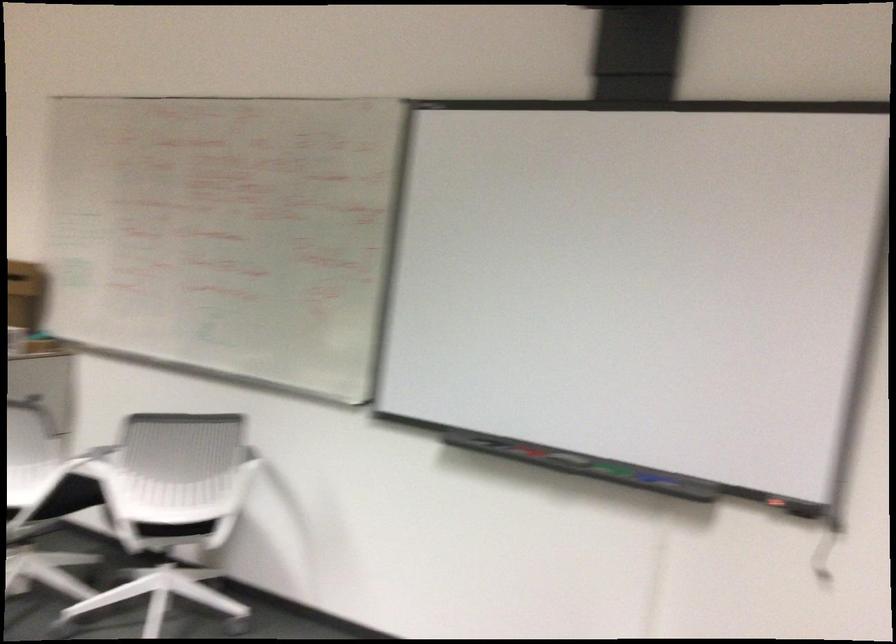
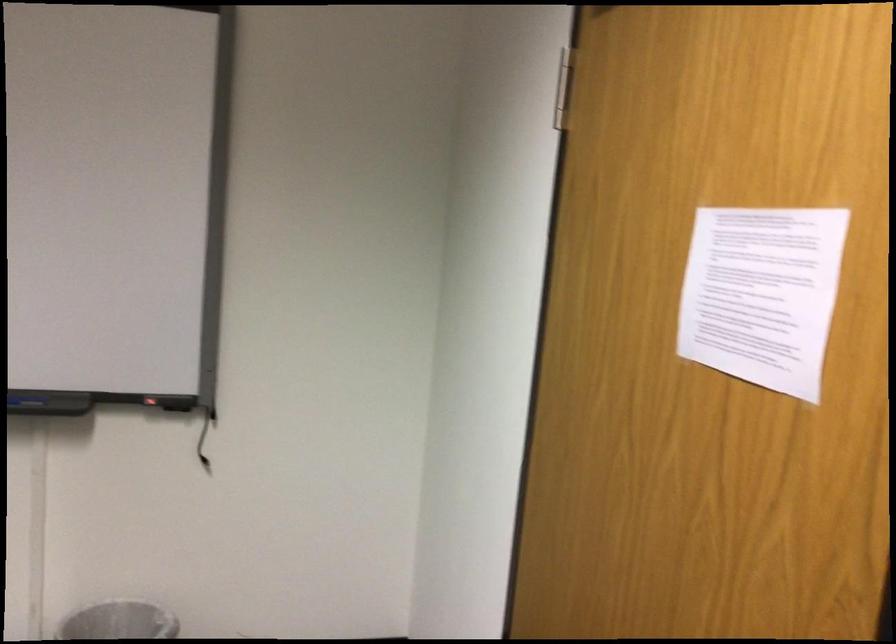
Question: The camera is either moving clockwise (left) or counter-clockwise (right) around the object. The first image is from the beginning of the video and the second image is from the end. Is the camera moving left or right when shooting the video?

Choices:
 (A) Left
 (B) Right

Answer: (A)